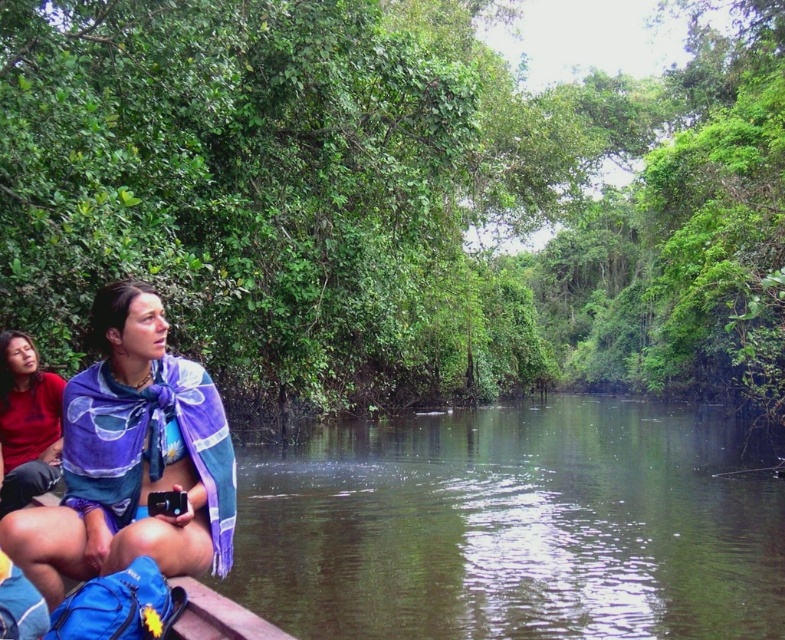
Question: Which point is closer to the camera taking this photo?

Choices:
 (A) (187, 476)
 (B) (0, 392)

Answer: (A)

Question: In this image, where is green murky water at center located relative to purple woven scarf at lower left?

Choices:
 (A) left
 (B) right

Answer: (B)

Question: Among these points, which one is farthest from the camera?

Choices:
 (A) coord(633,428)
 (B) coord(35,468)
 (C) coord(111,460)

Answer: (A)

Question: Which of the following is the farthest from the observer?

Choices:
 (A) (301, 616)
 (B) (27, 420)
 (C) (20, 509)
 (D) (455, 179)

Answer: (D)

Question: Does green murky water at center appear on the left side of purple woven scarf at lower left?

Choices:
 (A) yes
 (B) no

Answer: (B)

Question: Considering the relative positions of green leafy jungle at upper center and green murky water at center in the image provided, where is green leafy jungle at upper center located with respect to green murky water at center?

Choices:
 (A) above
 (B) below

Answer: (A)